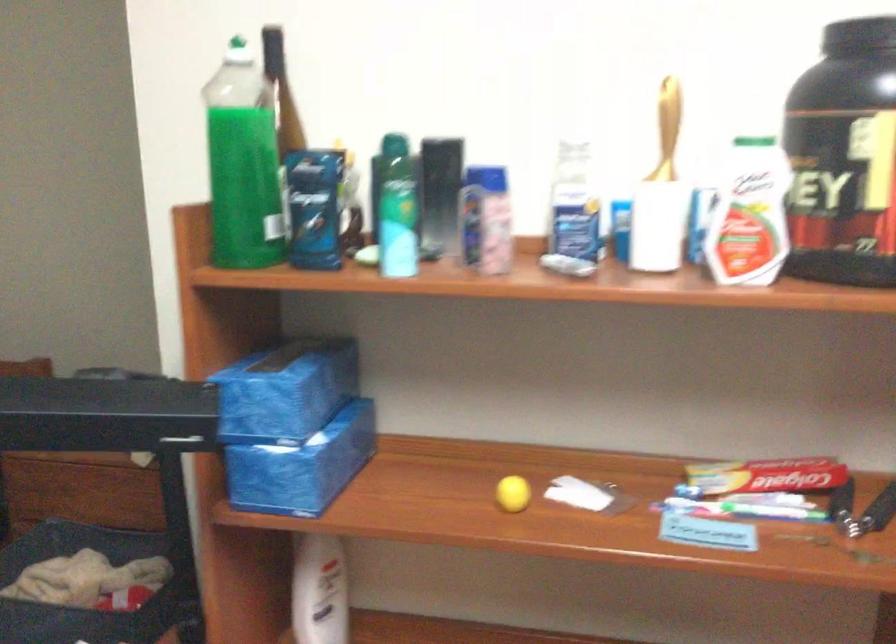
Where would you lift the green toothbrush? Please return your answer as a coordinate pair (x, y).

(743, 509)